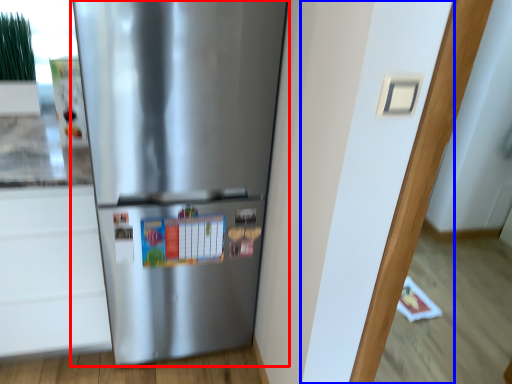
Question: Which object appears farthest to the camera in this image, refrigerator (highlighted by a red box) or door (highlighted by a blue box)?

Choices:
 (A) refrigerator
 (B) door

Answer: (A)